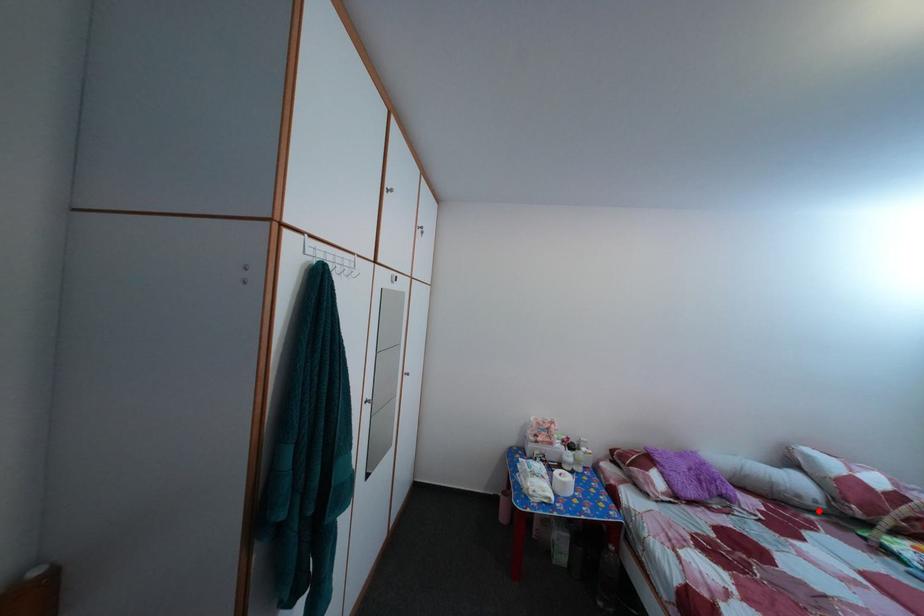
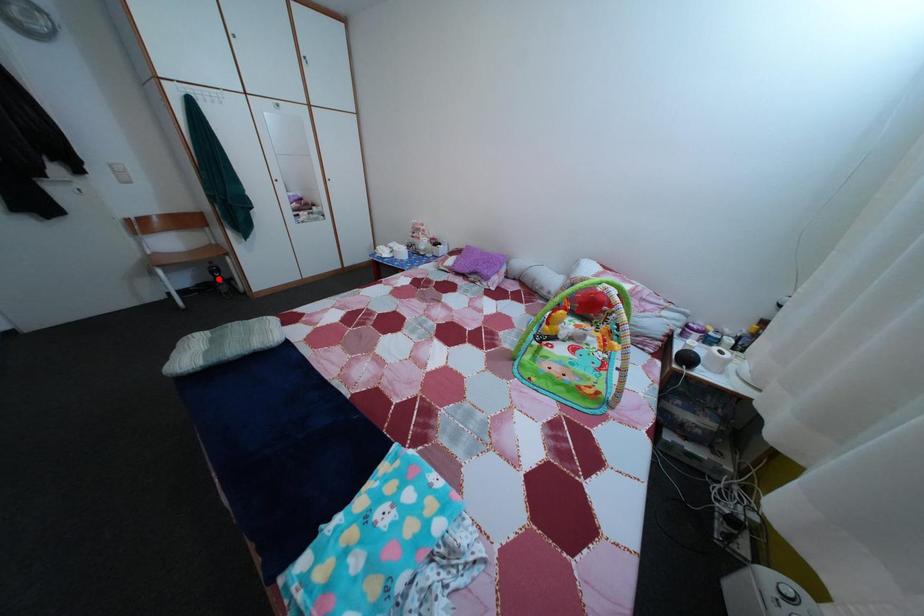
I am providing you with two images of the same scene from different viewpoints. A red point is marked on the first image and another point is marked on the second image. Do the highlighted points in image1 and image2 indicate the same real-world spot?

No